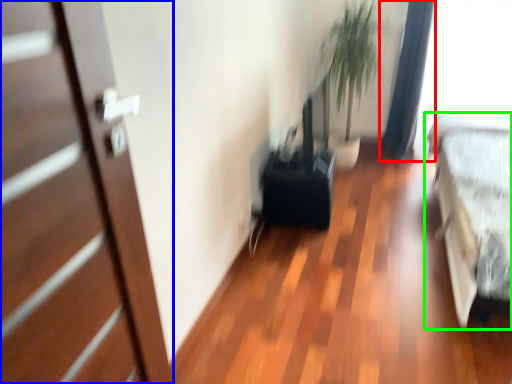
Question: Which object is positioned closest to curtain (highlighted by a red box)? Select from door (highlighted by a blue box) and bed (highlighted by a green box).

Choices:
 (A) door
 (B) bed

Answer: (B)